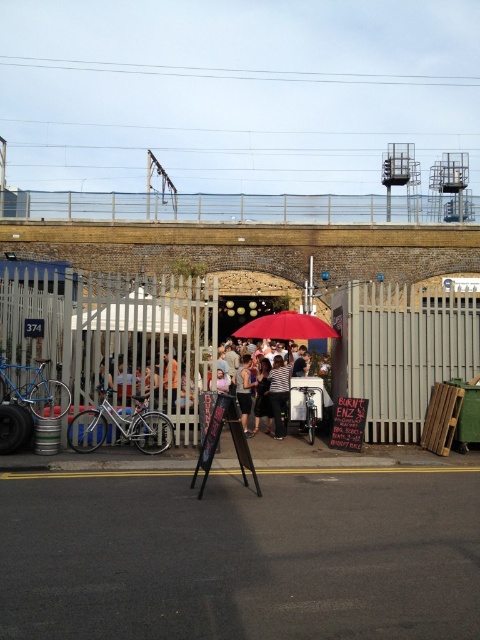
Does point (196, 346) lie in front of point (240, 401)?

Yes, it is in front of point (240, 401).

Can you confirm if white wooden fence at center is positioned to the right of matte black umbrella at center?

Incorrect, white wooden fence at center is not on the right side of matte black umbrella at center.

Between point (48, 317) and point (245, 355), which one is positioned in front?

Point (48, 317)

This screenshot has width=480, height=640. Find the location of `white wooden fence at center`. white wooden fence at center is located at coordinates (112, 333).

Between striped fabric shirt at center and brown leather jacket at center, which one appears on the right side from the viewer's perspective?

striped fabric shirt at center is more to the right.

From the picture: Does striped fabric shirt at center have a greater height compared to brown leather jacket at center?

Indeed, striped fabric shirt at center has a greater height compared to brown leather jacket at center.

Find the location of `striped fabric shirt at center`. striped fabric shirt at center is located at coordinates (278, 394).

Locate an element on the screen. The image size is (480, 640). striped fabric shirt at center is located at coordinates point(278,394).

Can you confirm if matte black umbrella at center is taller than striped fabric shirt at center?

Yes.

Who is more distant from viewer, (269, 422) or (278, 372)?

The point (269, 422) is behind.

Does point (256, 424) come behind point (287, 365)?

Yes, it is behind point (287, 365).

Locate an element on the screen. matte black umbrella at center is located at coordinates (260, 390).